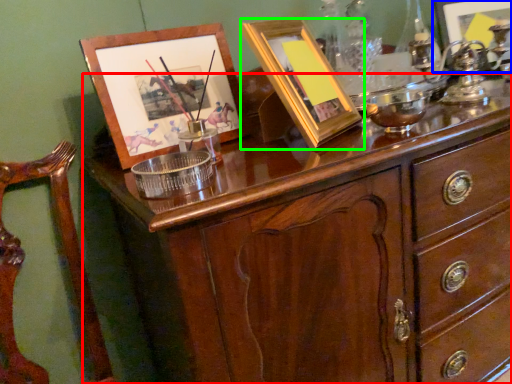
Question: Considering the real-world distances, which object is farthest from chest of drawers (highlighted by a red box)? picture frame (highlighted by a blue box) or picture frame (highlighted by a green box)?

Choices:
 (A) picture frame
 (B) picture frame

Answer: (A)